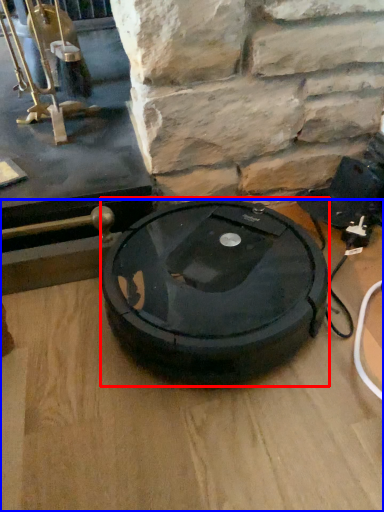
Question: Which object appears closest to the camera in this image, car tire (highlighted by a red box) or table top (highlighted by a blue box)?

Choices:
 (A) car tire
 (B) table top

Answer: (B)